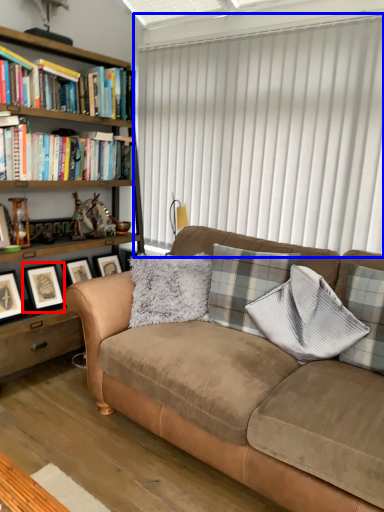
Question: Which of the following is the farthest to the observer, picture frame (highlighted by a red box) or window blind (highlighted by a blue box)?

Choices:
 (A) picture frame
 (B) window blind

Answer: (A)